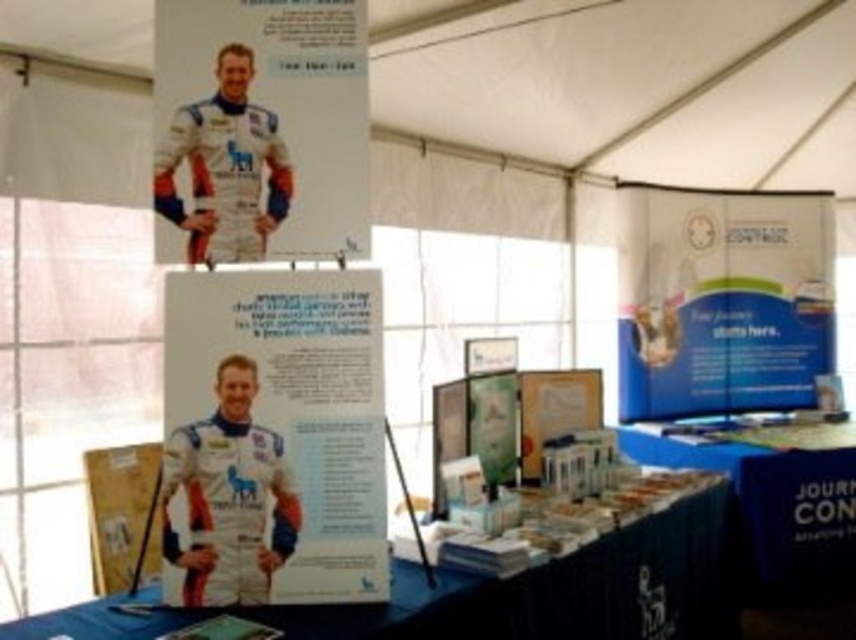
Question: Is white fabric poster at center bigger than blue fabric table at center?

Choices:
 (A) yes
 (B) no

Answer: (B)

Question: Estimate the real-world distances between objects in this image. Which object is closer to the white fabric poster at center?

Choices:
 (A) blue fabric table at lower right
 (B) white fabric astronaut at upper center

Answer: (B)

Question: Can you confirm if blue fabric banner at right is positioned above blue fabric table at lower right?

Choices:
 (A) yes
 (B) no

Answer: (A)

Question: Which of the following is the farthest from the observer?

Choices:
 (A) (330, 624)
 (B) (825, 364)
 (C) (177, 561)
 (D) (759, 566)

Answer: (B)

Question: Does white fabric poster at center have a lesser width compared to white fabric astronaut at upper center?

Choices:
 (A) yes
 (B) no

Answer: (B)

Question: Which point is closer to the camera?

Choices:
 (A) blue fabric table at lower right
 (B) white fabric astronaut at upper center

Answer: (B)